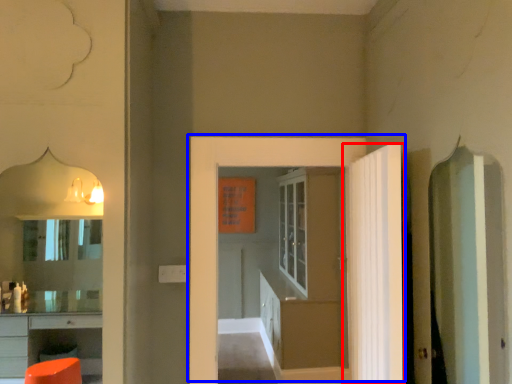
Question: Which of the following is the farthest to the observer, door (highlighted by a red box) or door (highlighted by a blue box)?

Choices:
 (A) door
 (B) door

Answer: (B)